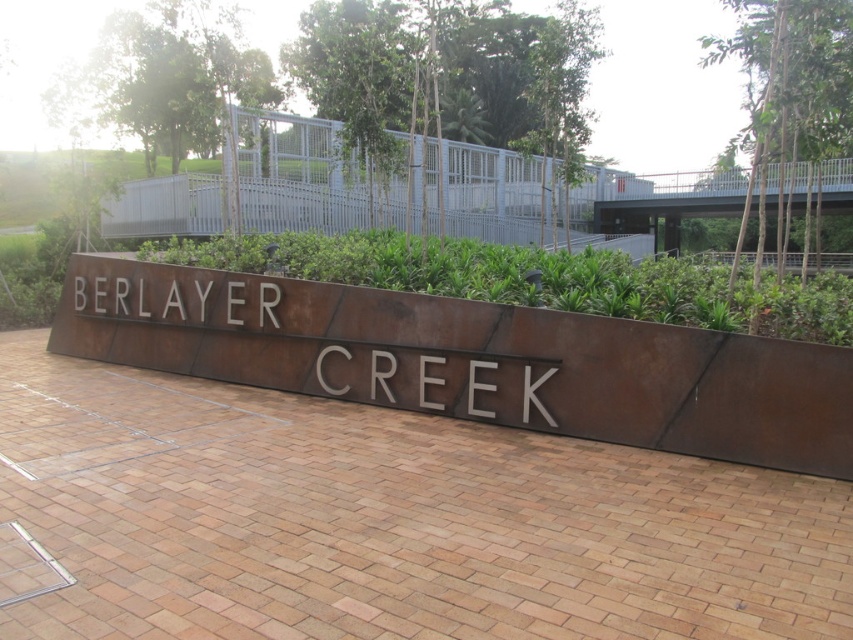
You are standing at the center of the paved area with the reddish brown bricks. You want to find the rusty metal sign at center. According to the coordinates provided, where should you look relative to your current position?

The rusty metal sign at center is located at coordinates point (471, 358), which is slightly to the right and slightly forward from your current position at the center of the paved area.

You are a landscape architect designing a pathway next to the rusty metal sign at center and the green leafy plants at center. If the pathway needs to be wider than both objects, which object requires more space to accommodate on either side?

The green leafy plants at center require more space because they have a greater width than the rusty metal sign at center, as stated in the description.

You are standing in a public garden and see the rusty metal sign at center and the green leafy plants at center. Which object is located more to the left?

The rusty metal sign at center is positioned on the left side of green leafy plants at center, so it is more to the left.